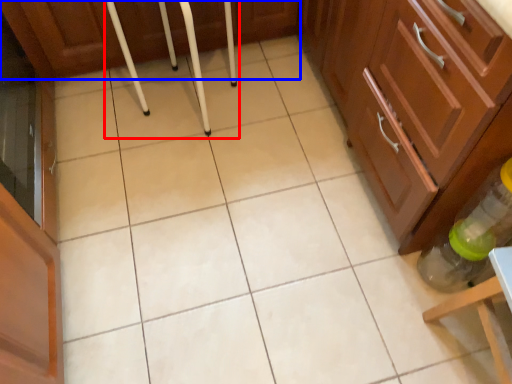
Question: Which object is closer to the camera taking this photo, bar stool (highlighted by a red box) or cabinetry (highlighted by a blue box)?

Choices:
 (A) bar stool
 (B) cabinetry

Answer: (A)